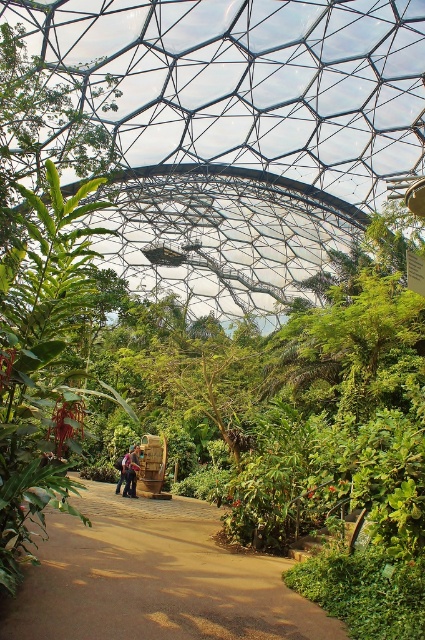
Consider the image. Does denim jacket at center appear on the right side of dark blue jeans at center?

Indeed, denim jacket at center is positioned on the right side of dark blue jeans at center.

Can you confirm if denim jacket at center is positioned to the left of dark blue jeans at center?

In fact, denim jacket at center is to the right of dark blue jeans at center.

I want to click on denim jacket at center, so click(x=130, y=472).

Can you confirm if brown dirt path at center is positioned below dark blue jeans at center?

No, brown dirt path at center is not below dark blue jeans at center.

Is brown dirt path at center above dark blue jeans at center?

Yes.

This screenshot has height=640, width=425. What are the coordinates of `brown dirt path at center` in the screenshot? It's located at (153, 579).

Locate an element on the screen. brown dirt path at center is located at coordinates (153, 579).

Does brown dirt path at center have a smaller size compared to denim jacket at center?

No.

Is the position of brown dirt path at center more distant than that of denim jacket at center?

No, it is not.

Measure the distance between brown dirt path at center and camera.

The distance of brown dirt path at center from camera is 6.04 meters.

Image resolution: width=425 pixels, height=640 pixels. Identify the location of brown dirt path at center. (153, 579).